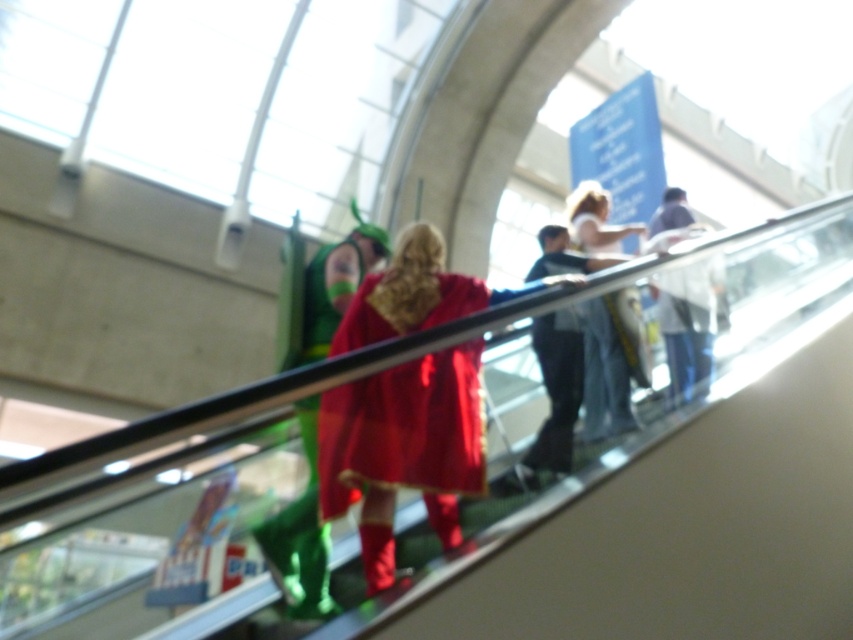
You are standing at the bottom of the escalator and notice two items at the center of the escalator steps. The velvet red cape at center and the denim jeans at center. Which item is closer to the bottom of the escalator?

The velvet red cape at center is below denim jeans at center, so the velvet red cape at center is closer to the bottom of the escalator.

You are standing at the bottom of the escalator and notice two points marked on the escalator steps. The first point is at coordinates point (x=340, y=452) and the second is at point (x=593, y=211). Which point is closer to your current position?

Point (x=340, y=452) is closer to the camera than point (x=593, y=211), so the first point is closer to your current position at the bottom of the escalator.